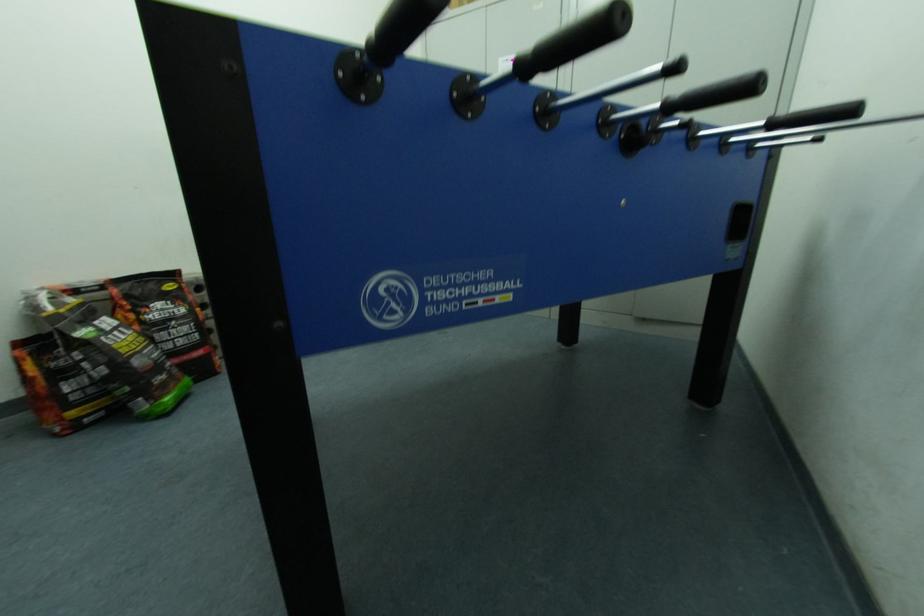
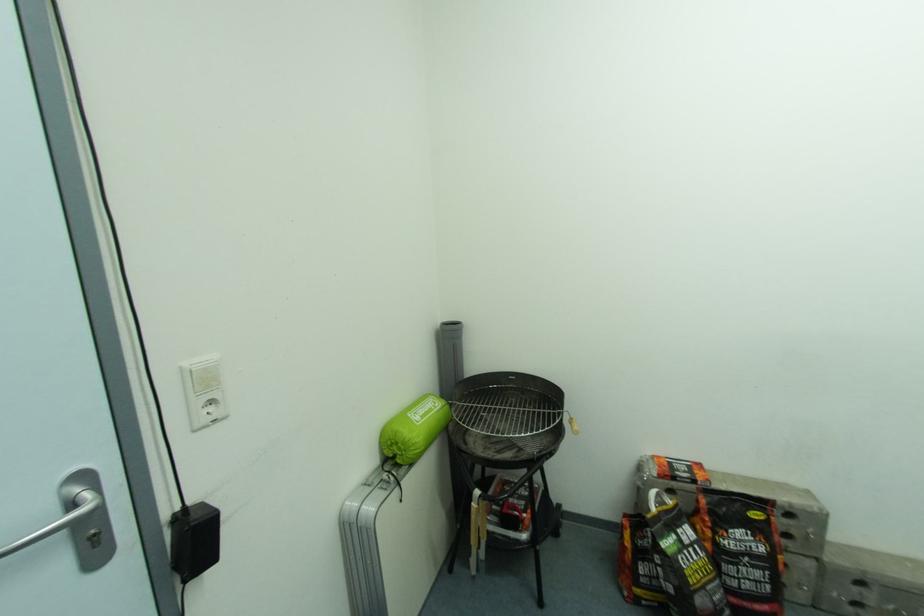
Question: The camera is either moving clockwise (left) or counter-clockwise (right) around the object. The first image is from the beginning of the video and the second image is from the end. Is the camera moving left or right when shooting the video?

Choices:
 (A) Left
 (B) Right

Answer: (B)